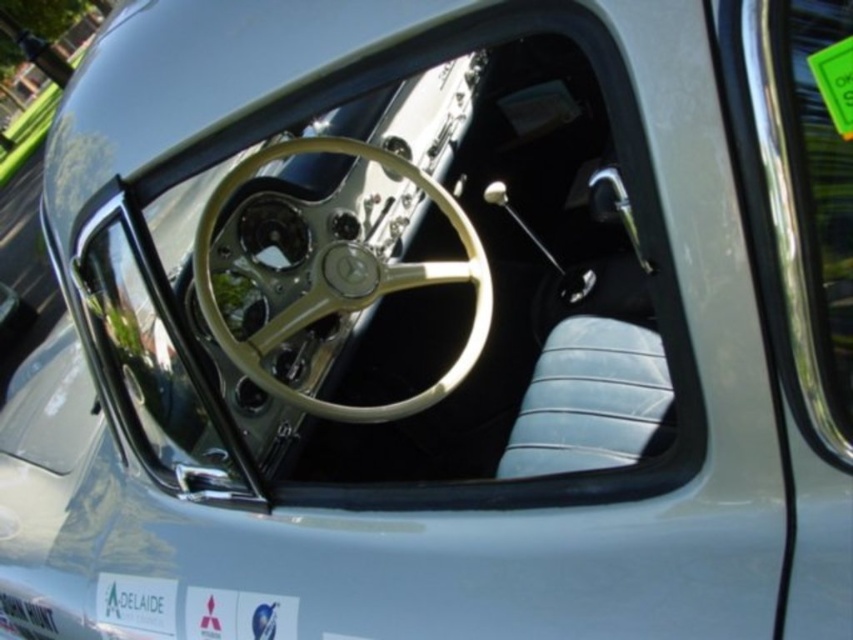
Question: Is gold metallic steering wheel at center smaller than white plastic license plate at lower left?

Choices:
 (A) no
 (B) yes

Answer: (A)

Question: Among these points, which one is nearest to the camera?

Choices:
 (A) (376, 275)
 (B) (51, 637)

Answer: (A)

Question: Does gold metallic steering wheel at center have a smaller size compared to polished chrome window at right?

Choices:
 (A) yes
 (B) no

Answer: (B)

Question: Which is farther from the polished chrome window at right?

Choices:
 (A) gold metallic steering wheel at center
 (B) white plastic license plate at lower left

Answer: (B)

Question: Can you confirm if gold metallic steering wheel at center is positioned below white plastic license plate at lower left?

Choices:
 (A) no
 (B) yes

Answer: (A)

Question: Which point is closer to the camera?

Choices:
 (A) (33, 636)
 (B) (437, 384)

Answer: (A)